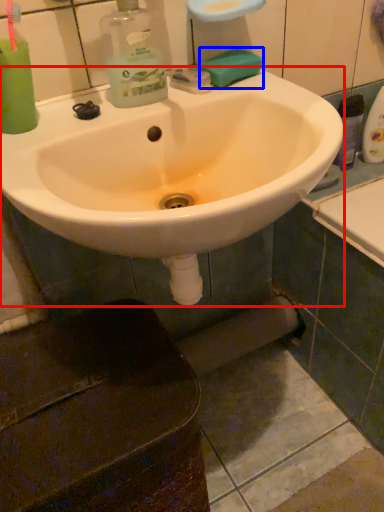
Question: Which point is further to the camera, sink (highlighted by a red box) or soap (highlighted by a blue box)?

Choices:
 (A) sink
 (B) soap

Answer: (B)